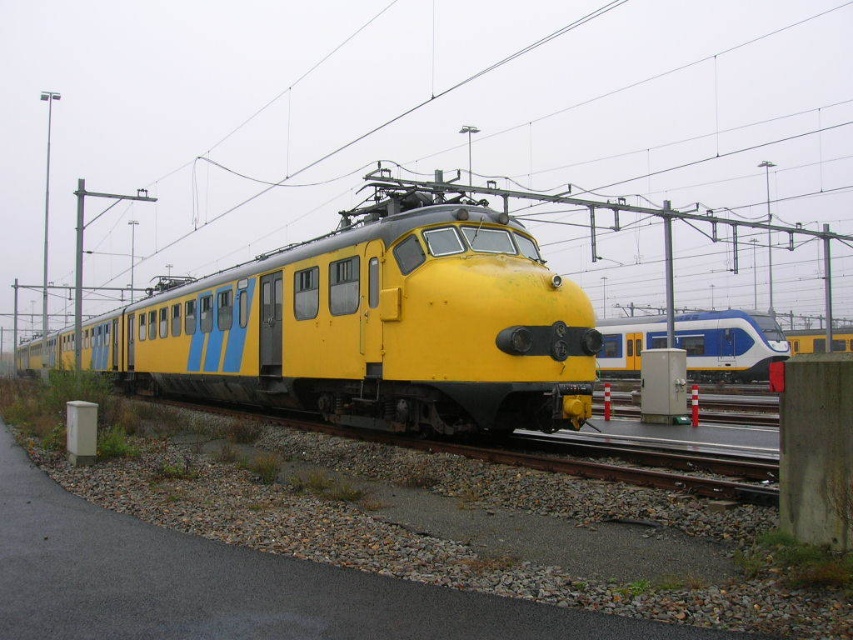
Question: Is yellow matte train at center to the left of blue glossy train at right from the viewer's perspective?

Choices:
 (A) yes
 (B) no

Answer: (A)

Question: Is yellow matte train at center smaller than blue glossy train at right?

Choices:
 (A) yes
 (B) no

Answer: (B)

Question: Can you confirm if yellow matte train at center is thinner than blue glossy train at right?

Choices:
 (A) no
 (B) yes

Answer: (A)

Question: Which of the following is the closest to the observer?

Choices:
 (A) yellow matte train at center
 (B) blue glossy train at right

Answer: (A)